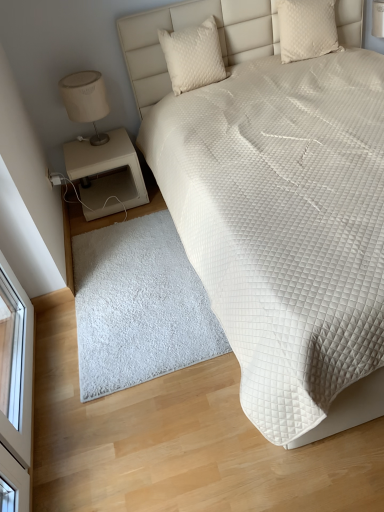
Where is `free region under matte beige lampshade at left (from a real-world perspective)`? The height and width of the screenshot is (512, 384). free region under matte beige lampshade at left (from a real-world perspective) is located at coordinates (98, 137).